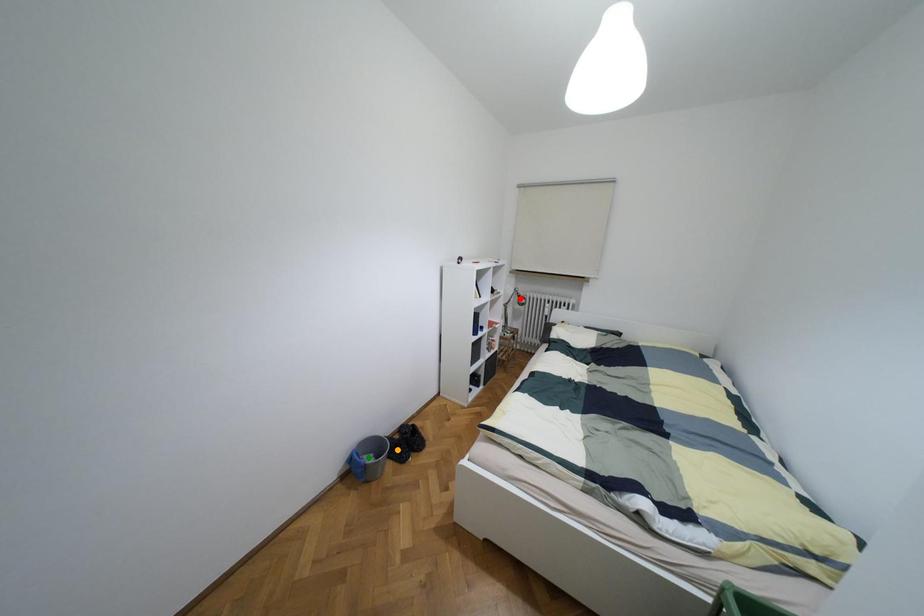
Order these from nearest to farthest:
red point
green point
orange point

green point
orange point
red point